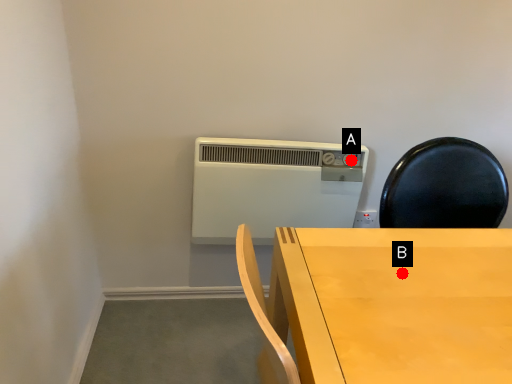
Question: Two points are circled on the image, labeled by A and B beside each circle. Which point is closer to the camera?

Choices:
 (A) A is closer
 (B) B is closer

Answer: (B)